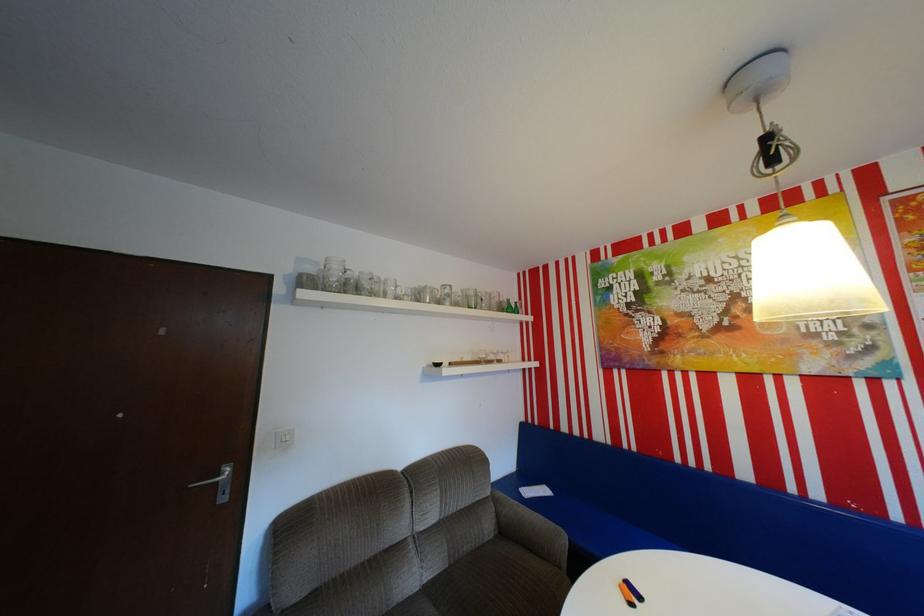
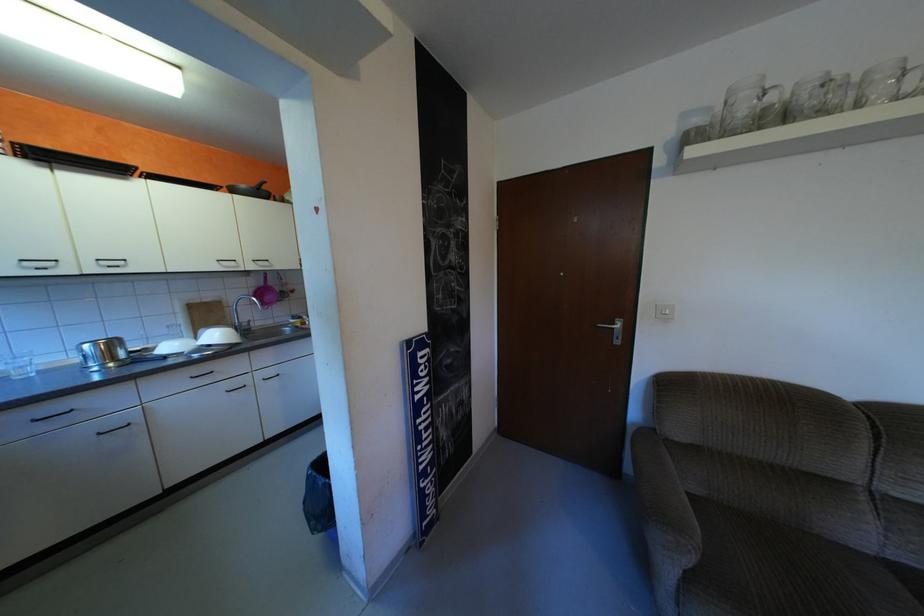
Question: The images are taken continuously from a first-person perspective. In which direction is your viewpoint rotating?

Choices:
 (A) Left
 (B) Right
 (C) Up
 (D) Down

Answer: (A)